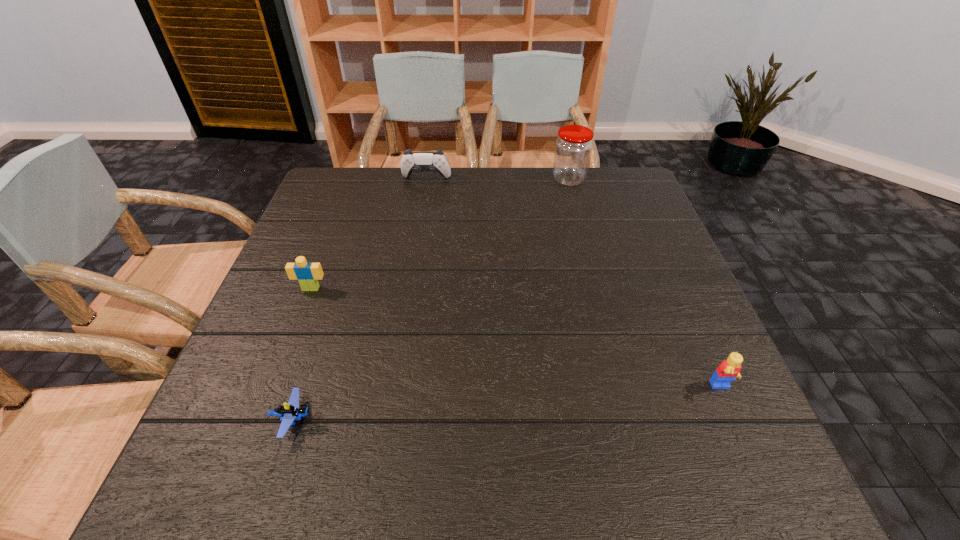
Identify the location of the tallest object. This screenshot has width=960, height=540. (573, 148).

Where is `the second object from right to left`? the second object from right to left is located at coordinates (573, 148).

You are a GUI agent. You are given a task and a screenshot of the screen. Output one action in this format:
    pyautogui.click(x=<x>, y=<y>)
    Task: Click on the control
    Image resolution: width=960 pixels, height=540 pixels.
    Given the screenshot: What is the action you would take?
    pyautogui.click(x=411, y=161)

Where is `the third farthest object`? This screenshot has height=540, width=960. the third farthest object is located at coordinates (308, 274).

Locate an element on the screen. This screenshot has height=540, width=960. the rightmost Lego is located at coordinates (728, 370).

I want to click on the shortest Lego, so click(291, 411).

The width and height of the screenshot is (960, 540). Find the location of `vacant area situated 0.070m on the front of the tallest object`. vacant area situated 0.070m on the front of the tallest object is located at coordinates (575, 202).

You are a GUI agent. You are given a task and a screenshot of the screen. Output one action in this format:
    pyautogui.click(x=<x>, y=<y>)
    Task: Click on the vacant area located 0.070m on the front-facing side of the control
    
    Given the screenshot: What is the action you would take?
    pyautogui.click(x=423, y=198)

Where is `vacant space located on the face of the farthest Lego`? Image resolution: width=960 pixels, height=540 pixels. vacant space located on the face of the farthest Lego is located at coordinates (275, 382).

This screenshot has height=540, width=960. In order to click on blank space located 0.120m on the face of the rightmost object in this screenshot , I will do `click(755, 461)`.